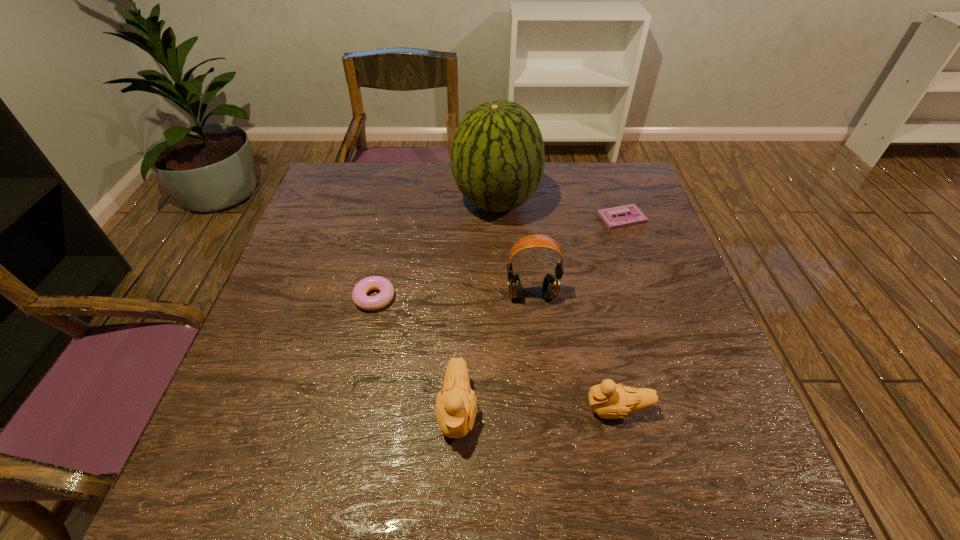
Where is `free spot between the leftmost object and the shorter duckling`? The image size is (960, 540). free spot between the leftmost object and the shorter duckling is located at coordinates (495, 354).

Where is `vacant space that's between the headset and the fourth shortest object`? vacant space that's between the headset and the fourth shortest object is located at coordinates (494, 353).

I want to click on free space between the headset and the fourth tallest object, so click(x=574, y=352).

The width and height of the screenshot is (960, 540). Find the location of `vacant area between the doughnut and the second tallest object`. vacant area between the doughnut and the second tallest object is located at coordinates (x=453, y=296).

Find the location of `free spot between the second object from right to left and the third tallest object`. free spot between the second object from right to left and the third tallest object is located at coordinates (537, 410).

Locate which object is the fifth closest to the third tallest object. Please provide its 2D coordinates. Your answer should be formatted as a tuple, i.e. [(x, y)], where the tuple contains the x and y coordinates of a point satisfying the conditions above.

[(634, 216)]

Where is `object that is the fifth closest to the second shortest object`? The image size is (960, 540). object that is the fifth closest to the second shortest object is located at coordinates (634, 216).

Where is `free region that satisfies the following two spatial constraints: 1. on the back side of the fifth tallest object; 2. on the right side of the watermelon`? The width and height of the screenshot is (960, 540). free region that satisfies the following two spatial constraints: 1. on the back side of the fifth tallest object; 2. on the right side of the watermelon is located at coordinates (396, 202).